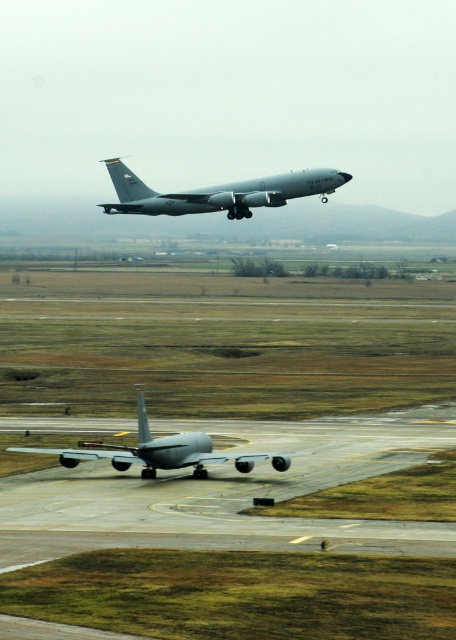
Does matte gray airplane at upper center have a lesser width compared to matte gray airplane at lower center?

In fact, matte gray airplane at upper center might be wider than matte gray airplane at lower center.

Does matte gray airplane at upper center have a smaller size compared to matte gray airplane at lower center?

No.

Identify the location of matte gray airplane at upper center. (219, 193).